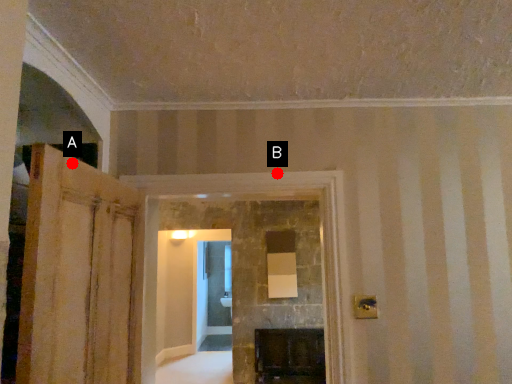
Question: Two points are circled on the image, labeled by A and B beside each circle. Among these points, which one is farthest from the camera?

Choices:
 (A) A is further
 (B) B is further

Answer: (B)